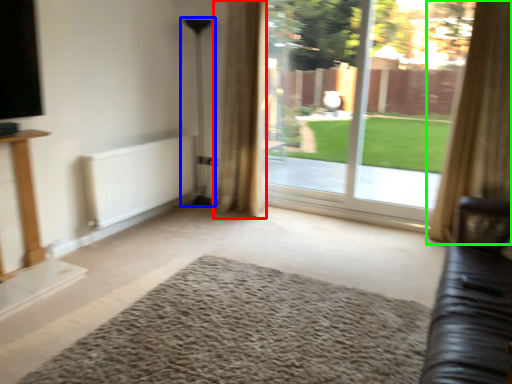
Question: Which object is the closest to the curtain (highlighted by a red box)? Choose among these: lamp (highlighted by a blue box) or curtain (highlighted by a green box).

Choices:
 (A) lamp
 (B) curtain

Answer: (A)